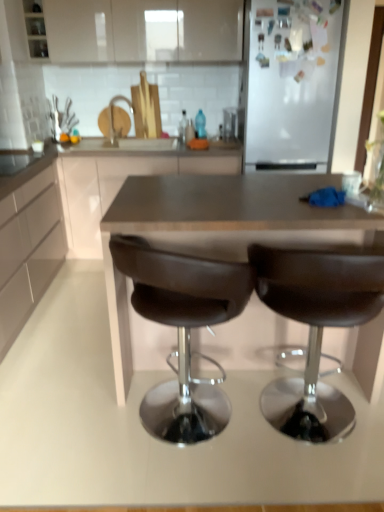
Question: Considering the positions of brushed metal faucet at upper center and white glossy cabinet at upper center, which appears as the 3th cabinetry when ordered from the bottom, in the image, is brushed metal faucet at upper center taller or shorter than white glossy cabinet at upper center, which appears as the 3th cabinetry when ordered from the bottom,?

Choices:
 (A) tall
 (B) short

Answer: (B)

Question: From a real-world perspective, is brushed metal faucet at upper center physically located above or below white glossy cabinet at upper center, marked as the 1th cabinetry in a top-to-bottom arrangement?

Choices:
 (A) above
 (B) below

Answer: (B)

Question: Which is nearer to the dark brown laminate counter at center?

Choices:
 (A) white matte cabinet at left, the 3th cabinetry from the top
 (B) white glossy cabinet at upper center, which appears as the 3th cabinetry when ordered from the bottom
 (C) brushed metal faucet at upper center
 (D) matte brown countertop at center, the 2th cabinetry when ordered from bottom to top
 (E) brown leather chair at center, which is the second chair in right-to-left order

Answer: (D)

Question: Based on their relative distances, which object is nearer to the white matte cabinet at left, the 3th cabinetry from the top?

Choices:
 (A) brown leather table at center
 (B) brown leather chair at center, the 2th chair when ordered from left to right
 (C) dark brown laminate counter at center
 (D) white glossy cabinet at upper center, which appears as the 3th cabinetry when ordered from the bottom
 (E) brown leather chair at center, which ranks as the 1th chair in left-to-right order

Answer: (C)